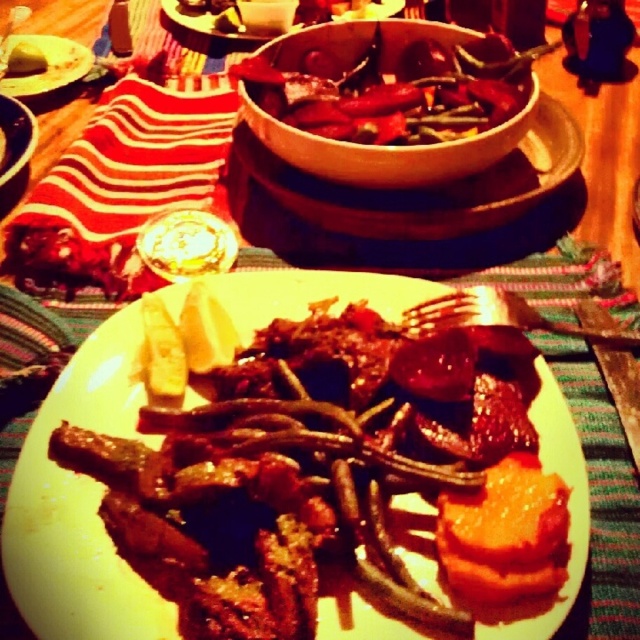
Question: Which object appears farthest from the camera in this image?

Choices:
 (A) green matte carrot at center
 (B) matte white plate at upper left
 (C) savory brown meat at center

Answer: (A)

Question: Is matte white plate at upper left closer to camera compared to matte brown bowl at upper center?

Choices:
 (A) no
 (B) yes

Answer: (B)

Question: Is smooth red chili pepper at center below matte white plate at upper left?

Choices:
 (A) yes
 (B) no

Answer: (A)

Question: Which of these objects is positioned farthest from the matte brown bowl at upper center?

Choices:
 (A) savory brown meat at center
 (B) green matte carrot at center

Answer: (A)

Question: Does smooth red chili pepper at center appear on the right side of matte white plate at upper left?

Choices:
 (A) no
 (B) yes

Answer: (B)

Question: Estimate the real-world distances between objects in this image. Which object is closer to the matte brown bowl at upper center?

Choices:
 (A) green matte carrot at center
 (B) savory brown meat at center
 (C) smooth red chili pepper at center
 (D) matte white plate at upper left

Answer: (D)